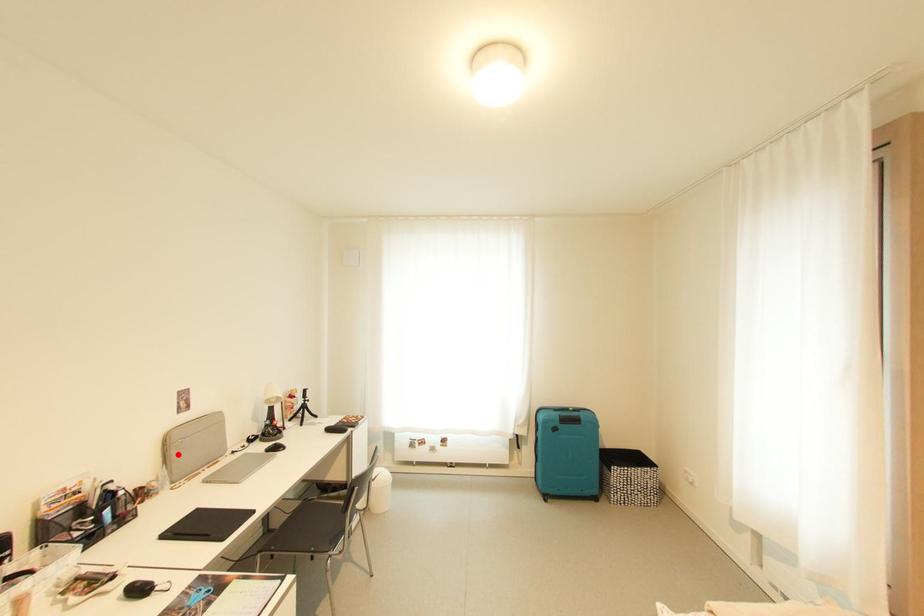
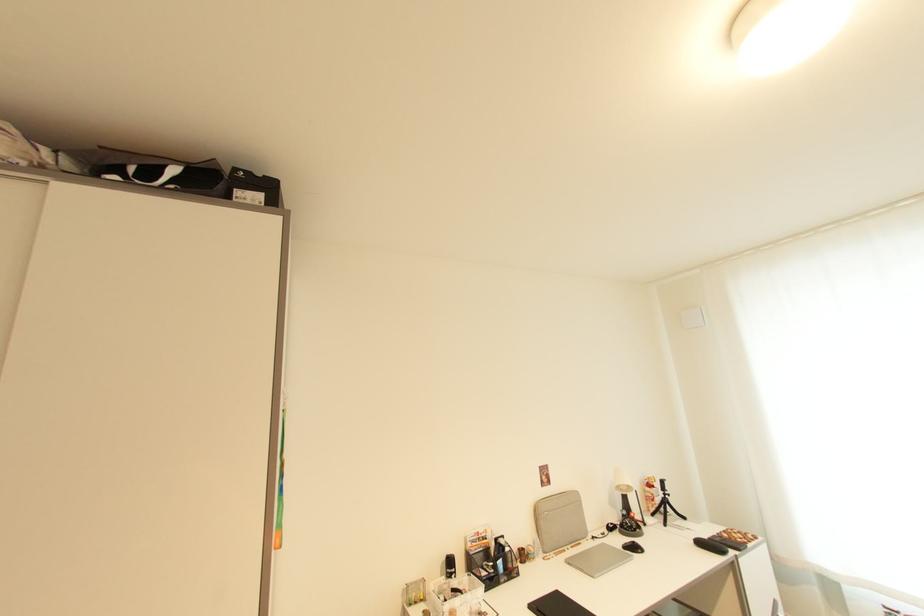
Where in the second image is the point corresponding to the highlighted location from the first image?

(546, 525)